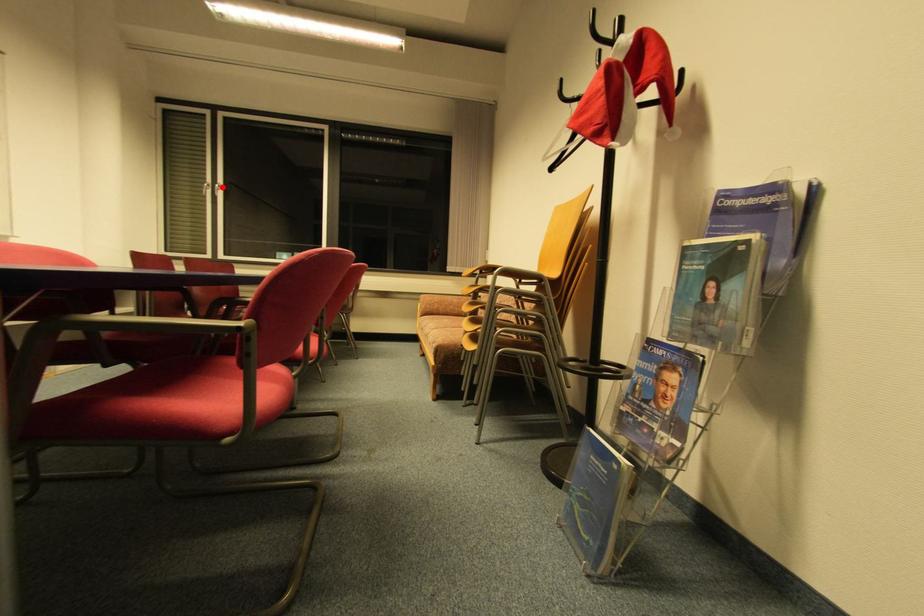
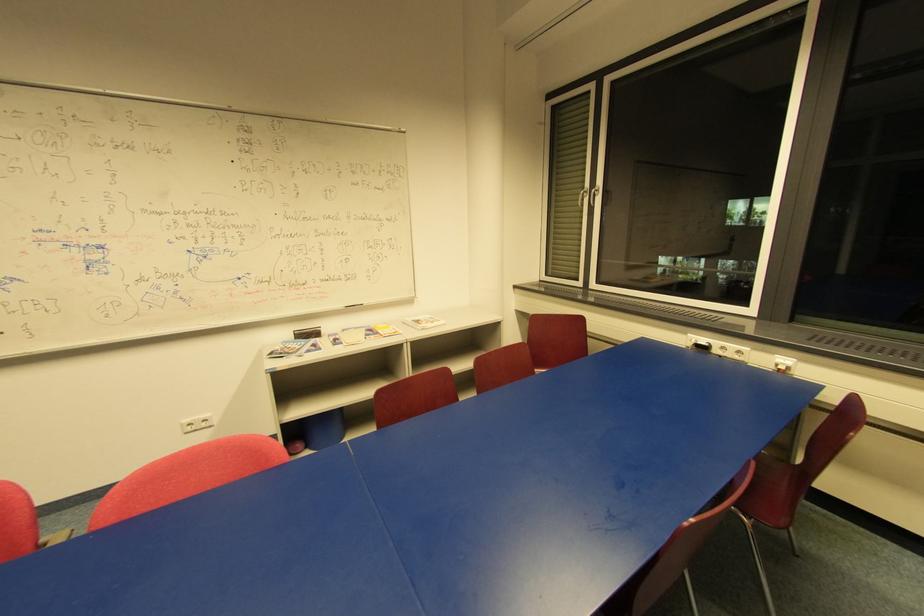
Where in the second image is the point corresponding to the highlighted location from the first image?

(598, 192)